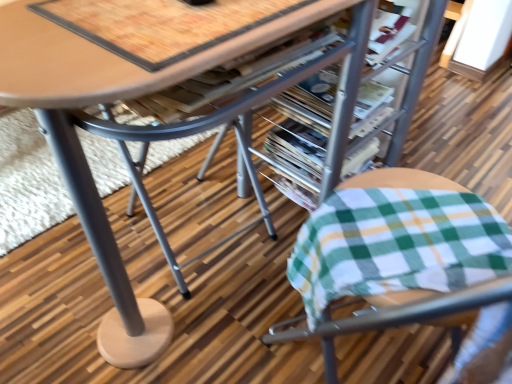
Question: Would you say metallic silver magazine at center, the first magazine viewed from the back, is a long distance from metallic silver magazine at center, the second magazine in the back-to-front sequence?

Choices:
 (A) no
 (B) yes

Answer: (A)

Question: Does metallic silver magazine at center, the second magazine in the front-to-back sequence, touch metallic silver magazine at center, the first magazine positioned from the front?

Choices:
 (A) no
 (B) yes

Answer: (B)

Question: Is metallic silver magazine at center, the second magazine in the front-to-back sequence, smaller than metallic silver magazine at center, the second magazine in the back-to-front sequence?

Choices:
 (A) no
 (B) yes

Answer: (A)

Question: Can metallic silver magazine at center, the second magazine in the back-to-front sequence, be found inside metallic silver magazine at center, the first magazine viewed from the back?

Choices:
 (A) no
 (B) yes

Answer: (A)

Question: Considering the relative sizes of metallic silver magazine at center, the first magazine viewed from the back, and metallic silver magazine at center, the second magazine in the back-to-front sequence, in the image provided, is metallic silver magazine at center, the first magazine viewed from the back, taller than metallic silver magazine at center, the second magazine in the back-to-front sequence,?

Choices:
 (A) yes
 (B) no

Answer: (A)

Question: Visually, is metallic silver magazine at center, the second magazine in the front-to-back sequence, positioned to the left or to the right of wooden table at center?

Choices:
 (A) left
 (B) right

Answer: (B)

Question: Considering the positions of metallic silver magazine at center, the second magazine in the front-to-back sequence, and wooden table at center in the image, is metallic silver magazine at center, the second magazine in the front-to-back sequence, wider or thinner than wooden table at center?

Choices:
 (A) wide
 (B) thin

Answer: (B)

Question: Relative to wooden table at center, is metallic silver magazine at center, the second magazine in the front-to-back sequence, in front or behind?

Choices:
 (A) behind
 (B) front

Answer: (A)

Question: Is metallic silver magazine at center, the second magazine in the front-to-back sequence, situated inside wooden table at center or outside?

Choices:
 (A) inside
 (B) outside

Answer: (A)

Question: From a real-world perspective, is green plaid fabric cushion at lower right physically located above or below metallic silver magazine at center, the second magazine in the front-to-back sequence?

Choices:
 (A) below
 (B) above

Answer: (B)

Question: From the image's perspective, is green plaid fabric cushion at lower right above or below metallic silver magazine at center, the first magazine viewed from the back?

Choices:
 (A) above
 (B) below

Answer: (B)

Question: Considering the relative positions of green plaid fabric cushion at lower right and metallic silver magazine at center, the second magazine in the front-to-back sequence, in the image provided, is green plaid fabric cushion at lower right to the left or to the right of metallic silver magazine at center, the second magazine in the front-to-back sequence,?

Choices:
 (A) left
 (B) right

Answer: (B)

Question: Does point (347, 271) appear closer or farther from the camera than point (298, 125)?

Choices:
 (A) closer
 (B) farther

Answer: (A)

Question: Is wooden table at center to the left or to the right of metallic silver magazine at center, the second magazine in the back-to-front sequence, in the image?

Choices:
 (A) left
 (B) right

Answer: (A)

Question: Considering their positions, is wooden table at center located in front of or behind metallic silver magazine at center, the first magazine positioned from the front?

Choices:
 (A) front
 (B) behind

Answer: (A)